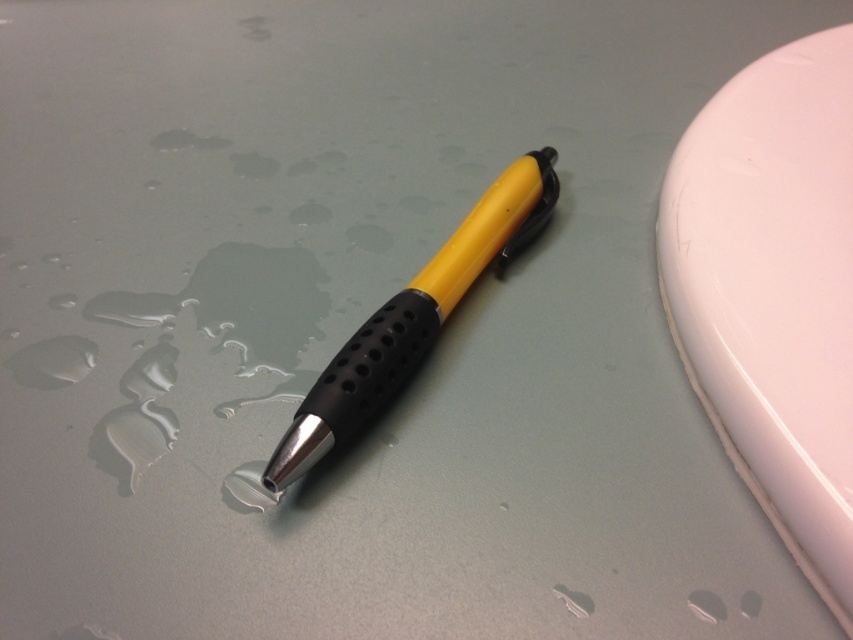
Question: Is white glossy eraser at upper right behind yellow matte pen at center?

Choices:
 (A) no
 (B) yes

Answer: (A)

Question: Among these objects, which one is farthest from the camera?

Choices:
 (A) white glossy eraser at upper right
 (B) yellow matte pen at center

Answer: (B)

Question: Does white glossy eraser at upper right have a smaller size compared to yellow matte pen at center?

Choices:
 (A) no
 (B) yes

Answer: (A)

Question: Does white glossy eraser at upper right appear over yellow matte pen at center?

Choices:
 (A) yes
 (B) no

Answer: (A)

Question: Among these objects, which one is farthest from the camera?

Choices:
 (A) yellow matte pen at center
 (B) white glossy eraser at upper right

Answer: (A)

Question: Among these points, which one is farthest from the camera?

Choices:
 (A) (434, 273)
 (B) (820, 349)

Answer: (A)